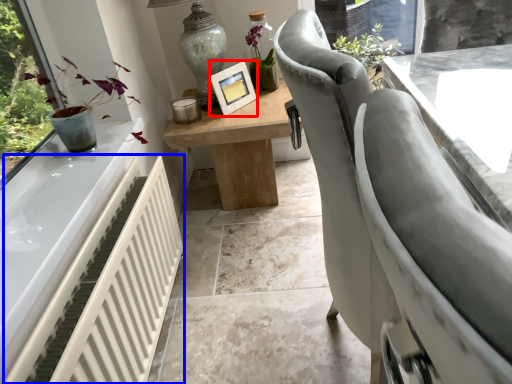
Question: Which point is closer to the camera, picture frame (highlighted by a red box) or radiator (highlighted by a blue box)?

Choices:
 (A) picture frame
 (B) radiator

Answer: (B)